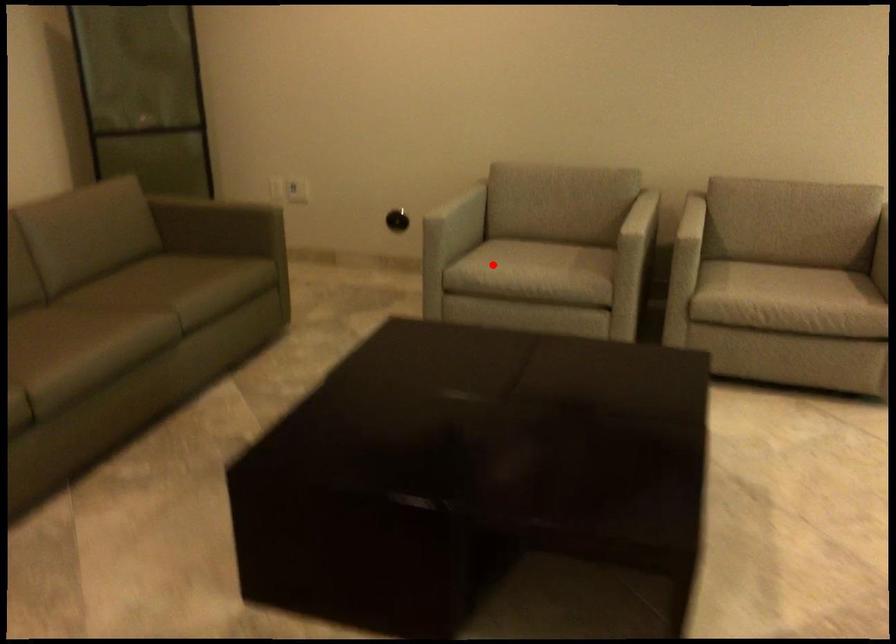
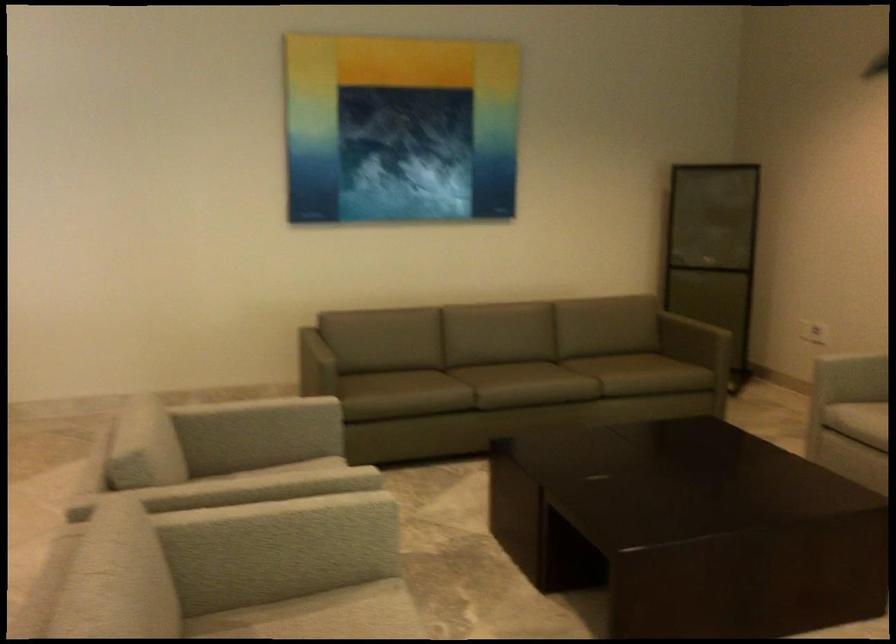
Question: I am providing you with two images of the same scene from different viewpoints. Given a red point in image1, look at the same physical point in image2. Is it:

Choices:
 (A) Closer to the viewpoint
 (B) Farther from the viewpoint

Answer: (B)